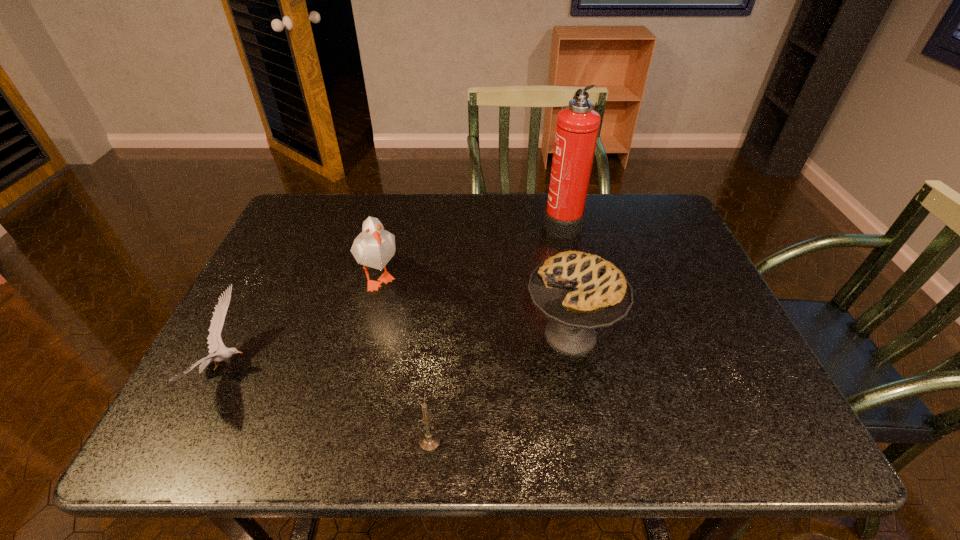
The image size is (960, 540). In order to click on object that is the third closest to the third object from left to right in this screenshot , I will do `click(214, 339)`.

The width and height of the screenshot is (960, 540). I want to click on vacant region that satisfies the following two spatial constraints: 1. on the back side of the candle; 2. at the tip of the beak of the leftmost object, so click(436, 368).

The height and width of the screenshot is (540, 960). I want to click on vacant space that satisfies the following two spatial constraints: 1. on the front-facing side of the tallest object; 2. on the front side of the third object from left to right, so click(612, 442).